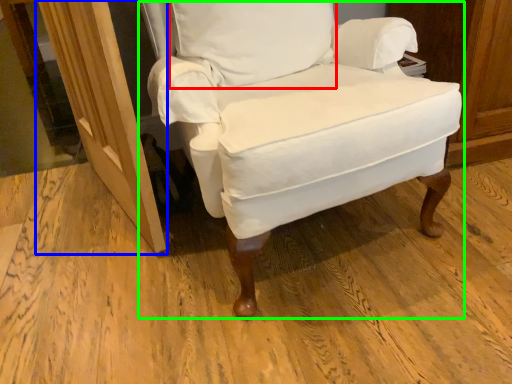
Question: Which object is positioned farthest from pillow (highlighted by a red box)? Select from screen door (highlighted by a blue box) and chair (highlighted by a green box).

Choices:
 (A) screen door
 (B) chair

Answer: (A)